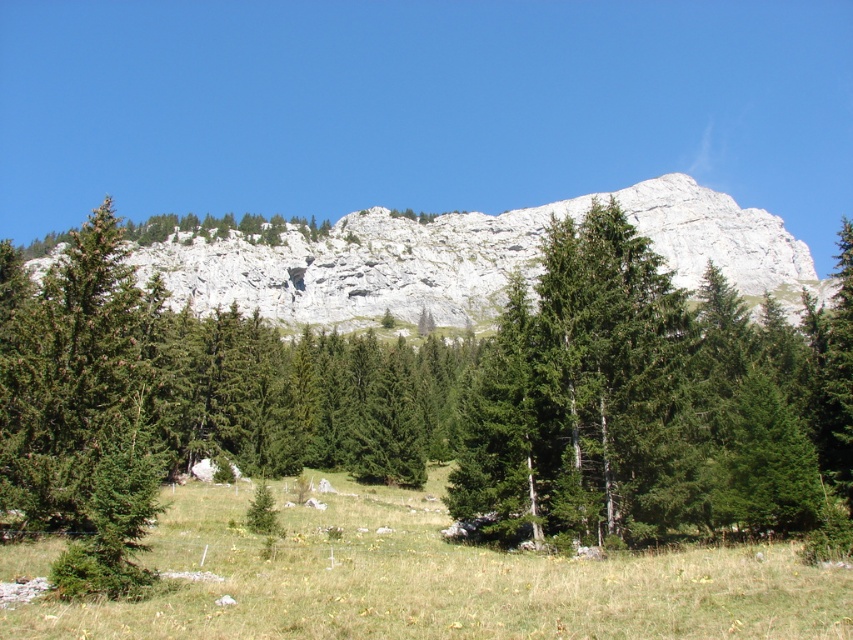
You are standing at the point marked by the coordinate point (434, 579) in the mountainous landscape. Looking around, you see the green grassy field at lower center. Which direction should you walk to reach the dense cluster of evergreen trees?

The dense cluster of evergreen trees is located in the foreground, which is typically closer to the viewer. Since the point marks the green grassy field at lower center, walking towards the foreground would mean moving upward in the image, likely towards the bottom of the image if the point is at lower center. However, without explicit spatial relations between the grassy field and the trees, the answer might need adjustment based on standard landscape composition where foreground elements are closer. The 0

You are standing at the camera position observing the mountain landscape. There are two points marked in the image, point 1 at coordinates point 1 at point (x=837, y=632) and point 2 at point (x=752, y=305). Which point is closer to you?

Point 1 at point (x=837, y=632) is closer to you than point 2 at point (x=752, y=305).